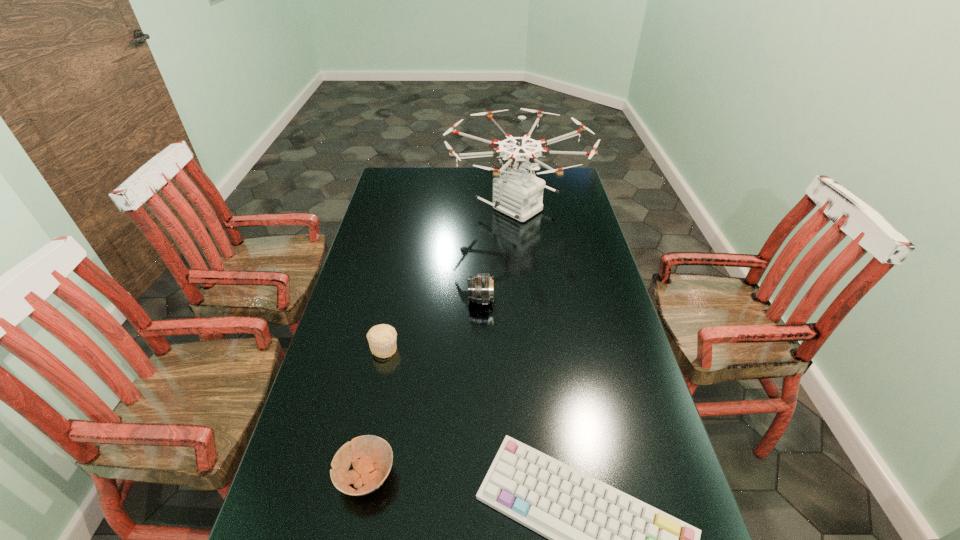
Locate an element on the screen. This screenshot has width=960, height=540. free space between the drone and the second tallest object is located at coordinates (498, 254).

Where is `object that is the third nearest to the tallest object`? object that is the third nearest to the tallest object is located at coordinates (601, 539).

Where is `the third closest object to the tallest object`? The height and width of the screenshot is (540, 960). the third closest object to the tallest object is located at coordinates pos(601,539).